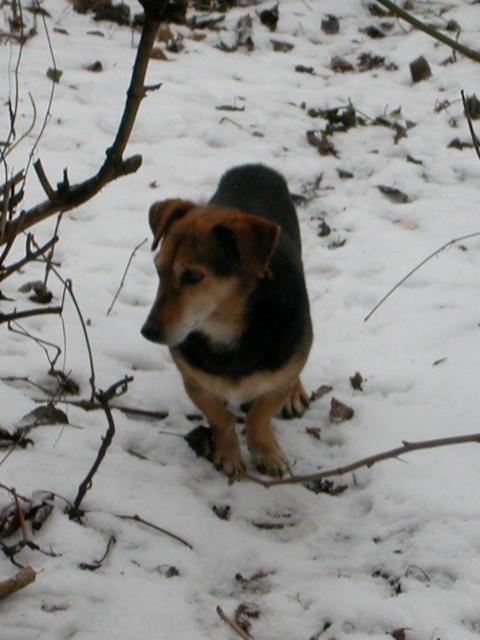
Question: Which point is closer to the camera taking this photo?

Choices:
 (A) (328, 468)
 (B) (283, 204)

Answer: (B)

Question: Where is brown fur dog at center located in relation to brown woody branch at lower center in the image?

Choices:
 (A) below
 (B) above

Answer: (B)

Question: Among these objects, which one is nearest to the camera?

Choices:
 (A) brown woody branch at lower center
 (B) brown fur dog at center

Answer: (A)

Question: Is brown fur dog at center above brown woody branch at lower center?

Choices:
 (A) no
 (B) yes

Answer: (B)

Question: Is brown fur dog at center to the left of brown woody branch at lower center from the viewer's perspective?

Choices:
 (A) yes
 (B) no

Answer: (A)